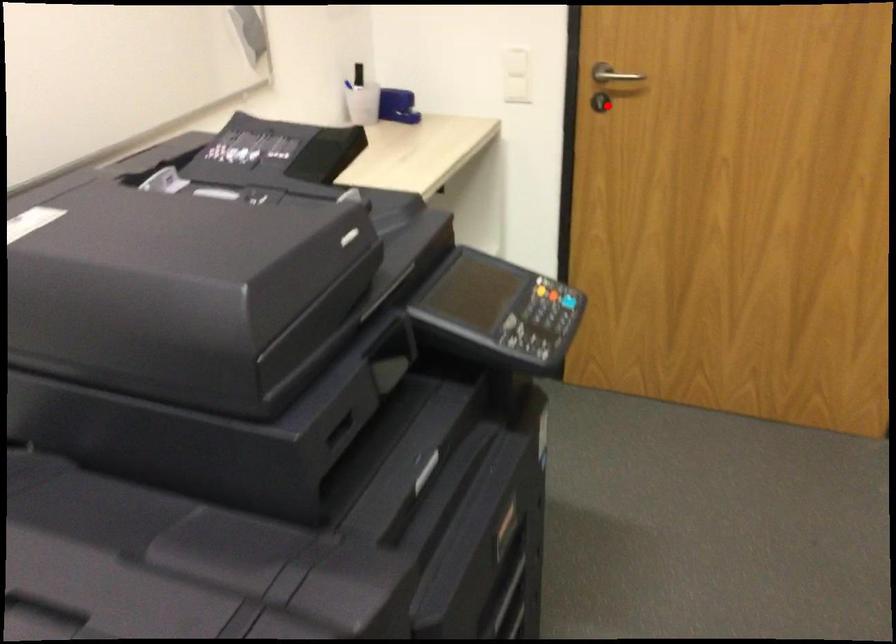
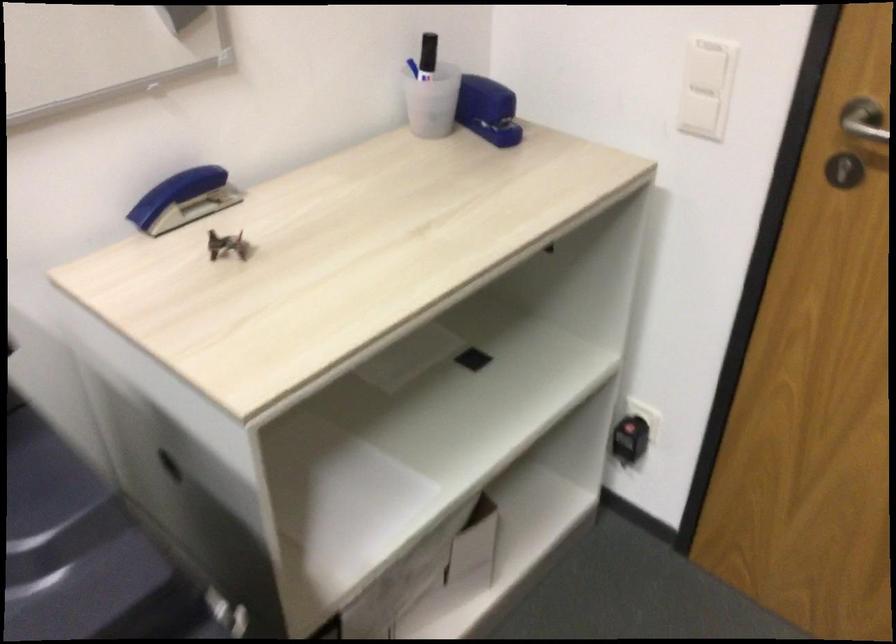
Question: I am providing you with two images of the same scene from different viewpoints. A red point is marked on the first image. Is the red point's position out of view in image 2?

Choices:
 (A) Yes
 (B) No

Answer: (B)